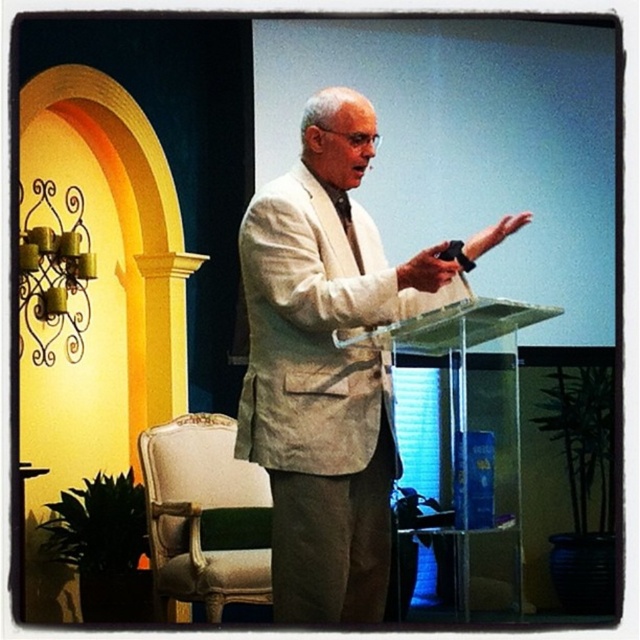
Does light beige fabric armchair at lower left have a greater height compared to transparent acrylic podium at center?

No.

Does point (259, 468) come behind point (348, 337)?

Yes, point (259, 468) is farther from viewer.

Is point (257, 467) in front of point (454, 346)?

No.

What are the coordinates of `light beige fabric armchair at lower left` in the screenshot? It's located at (200, 516).

Is white textured suit at center bigger than transparent acrylic podium at center?

Yes, white textured suit at center is bigger than transparent acrylic podium at center.

The height and width of the screenshot is (640, 640). Describe the element at coordinates (326, 365) in the screenshot. I see `white textured suit at center` at that location.

At what (x,y) coordinates should I click in order to perform the action: click on white textured suit at center. Please return your answer as a coordinate pair (x, y). Looking at the image, I should click on (326, 365).

This screenshot has height=640, width=640. What do you see at coordinates (326, 365) in the screenshot? I see `white textured suit at center` at bounding box center [326, 365].

Find the location of `white textured suit at center`. white textured suit at center is located at coordinates (326, 365).

What are the coordinates of `white textured suit at center` in the screenshot? It's located at (326, 365).